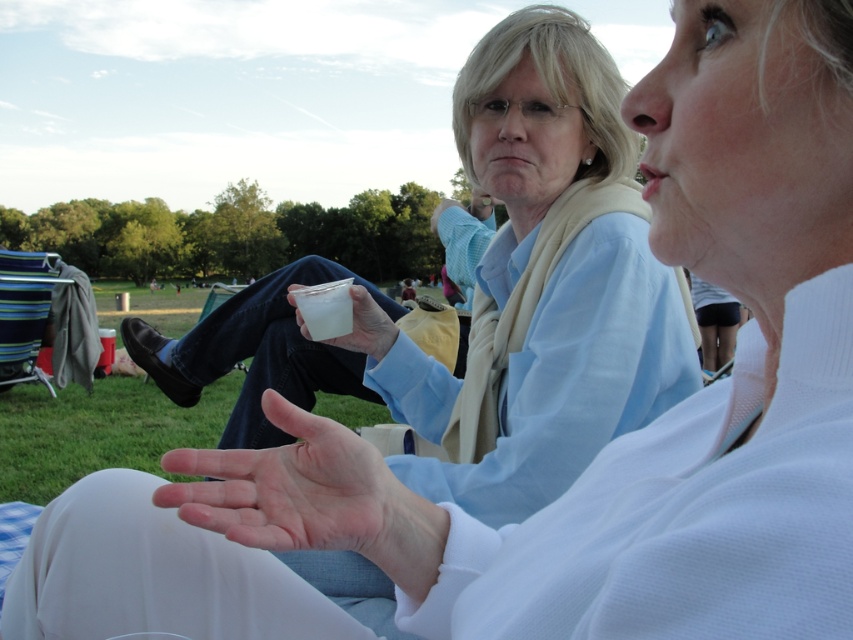
Question: Is pale skin palm at center smaller than clear plastic cup at center?

Choices:
 (A) yes
 (B) no

Answer: (B)

Question: Which object is the farthest from the translucent plastic cup at center?

Choices:
 (A) clear plastic cup at center
 (B) pale skin palm at center

Answer: (B)

Question: Which of these objects is positioned farthest from the pale skin palm at center?

Choices:
 (A) translucent plastic cup at center
 (B) clear plastic cup at center

Answer: (A)

Question: Which of the following is the closest to the observer?

Choices:
 (A) (345, 291)
 (B) (415, 496)
 (C) (294, 301)

Answer: (B)

Question: Can you confirm if translucent plastic cup at center is positioned to the right of clear plastic cup at center?

Choices:
 (A) yes
 (B) no

Answer: (A)

Question: Is pale skin palm at center positioned at the back of translucent plastic cup at center?

Choices:
 (A) no
 (B) yes

Answer: (A)